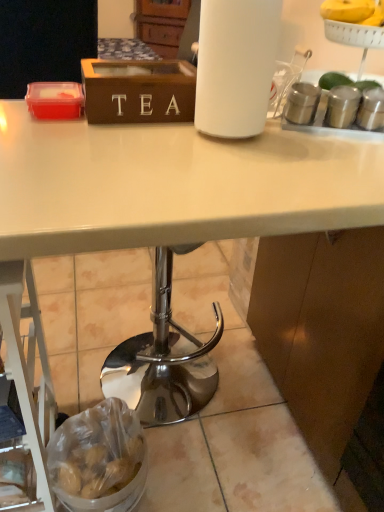
Question: Considering the relative sizes of translucent plastic bag of potatoes at lower left and wooden tea box at upper center in the image provided, is translucent plastic bag of potatoes at lower left thinner than wooden tea box at upper center?

Choices:
 (A) no
 (B) yes

Answer: (A)

Question: Does translucent plastic bag of potatoes at lower left touch wooden tea box at upper center?

Choices:
 (A) yes
 (B) no

Answer: (B)

Question: Is translucent plastic bag of potatoes at lower left facing away from wooden tea box at upper center?

Choices:
 (A) yes
 (B) no

Answer: (B)

Question: Is translucent plastic bag of potatoes at lower left taller than wooden tea box at upper center?

Choices:
 (A) yes
 (B) no

Answer: (A)

Question: Can you confirm if translucent plastic bag of potatoes at lower left is shorter than wooden tea box at upper center?

Choices:
 (A) yes
 (B) no

Answer: (B)

Question: Is wooden tea box at upper center inside translucent plastic bag of potatoes at lower left?

Choices:
 (A) no
 (B) yes

Answer: (A)

Question: Is wooden tea box at upper center turned away from translucent plastic bag of potatoes at lower left?

Choices:
 (A) yes
 (B) no

Answer: (B)

Question: Is wooden tea box at upper center positioned behind translucent plastic bag of potatoes at lower left?

Choices:
 (A) yes
 (B) no

Answer: (B)

Question: From a real-world perspective, is wooden tea box at upper center positioned over translucent plastic bag of potatoes at lower left based on gravity?

Choices:
 (A) yes
 (B) no

Answer: (A)

Question: From the image's perspective, does wooden tea box at upper center appear higher than translucent plastic bag of potatoes at lower left?

Choices:
 (A) yes
 (B) no

Answer: (A)

Question: Considering the relative sizes of wooden tea box at upper center and translucent plastic bag of potatoes at lower left in the image provided, is wooden tea box at upper center bigger than translucent plastic bag of potatoes at lower left?

Choices:
 (A) no
 (B) yes

Answer: (A)

Question: Does wooden tea box at upper center have a lesser height compared to translucent plastic bag of potatoes at lower left?

Choices:
 (A) no
 (B) yes

Answer: (B)

Question: Does point (160, 100) appear closer or farther from the camera than point (56, 431)?

Choices:
 (A) closer
 (B) farther

Answer: (A)